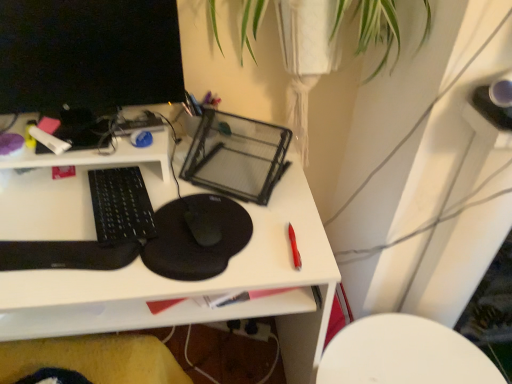
Where is `vacant area that lies in front of red plastic pen at right, arranged as the second stationery when viewed from the top`? The width and height of the screenshot is (512, 384). vacant area that lies in front of red plastic pen at right, arranged as the second stationery when viewed from the top is located at coordinates (285, 273).